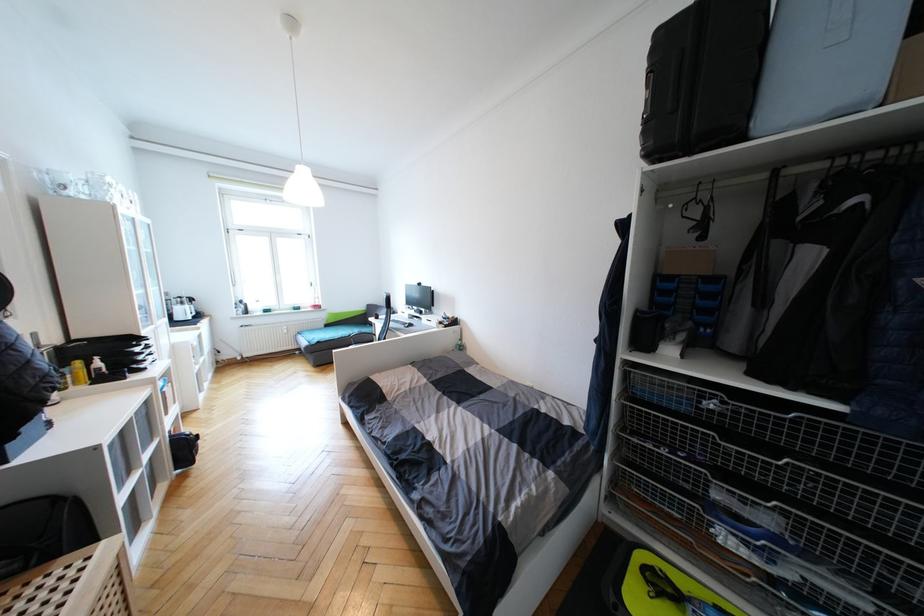
This screenshot has height=616, width=924. What are the coordinates of `sofa sitting surface` in the screenshot? It's located at (332, 331).